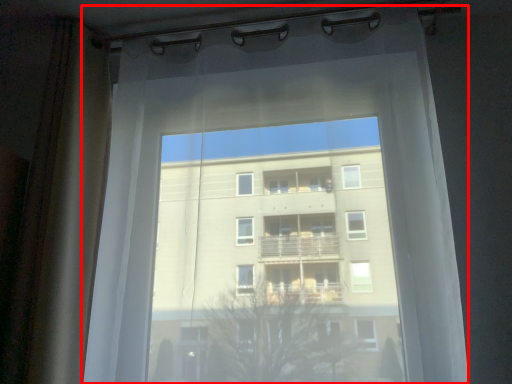
Question: In this image, where is curtain (annotated by the red box) located relative to shower curtain?

Choices:
 (A) right
 (B) left

Answer: (A)